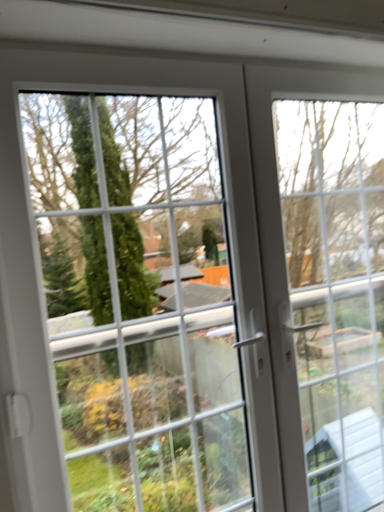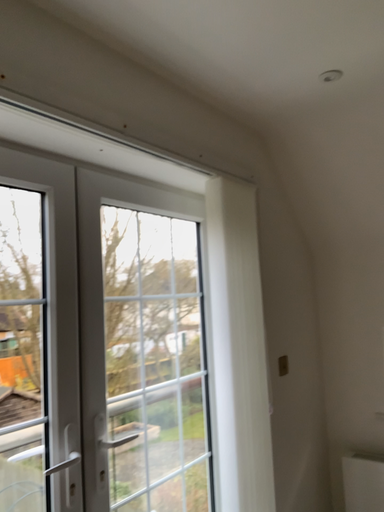
Question: How did the camera likely rotate when shooting the video?

Choices:
 (A) rotated upward
 (B) rotated downward

Answer: (A)